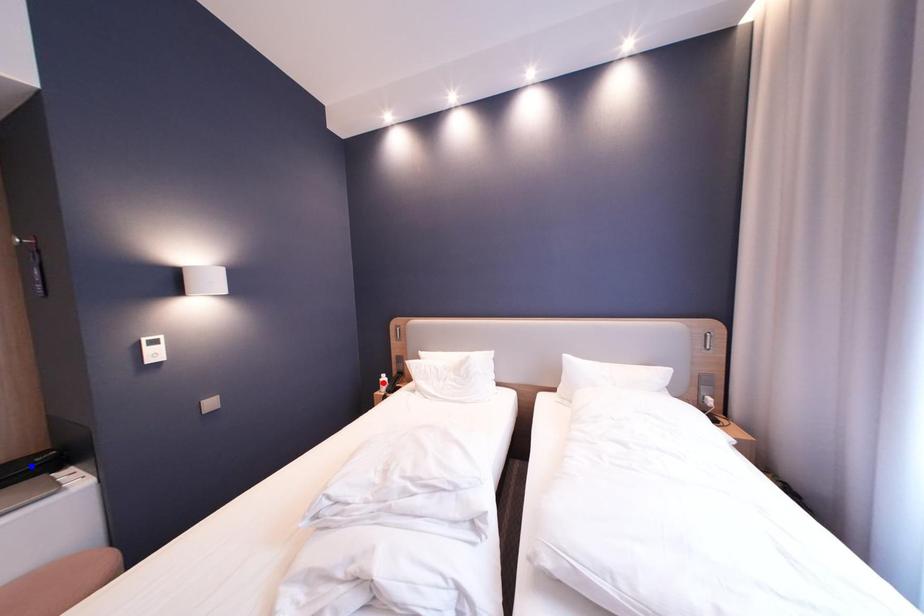
Question: Which of the two points in the image is closer to the camera?

Choices:
 (A) Blue point is closer.
 (B) Red point is closer.

Answer: (A)